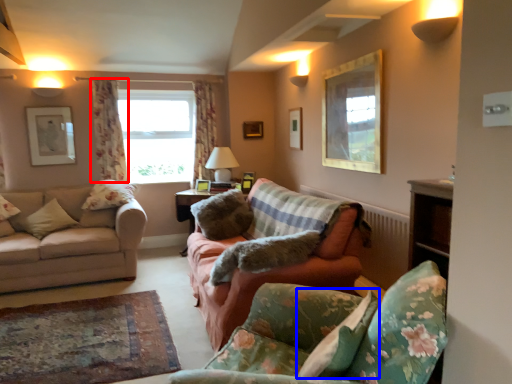
Question: Which object is closer to the camera taking this photo, curtain (highlighted by a red box) or pillow (highlighted by a blue box)?

Choices:
 (A) curtain
 (B) pillow

Answer: (B)